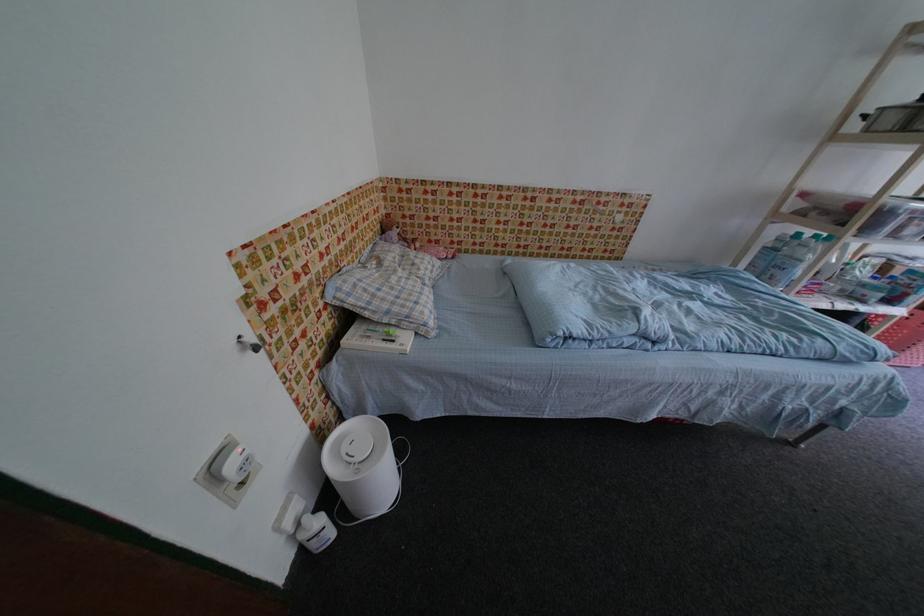
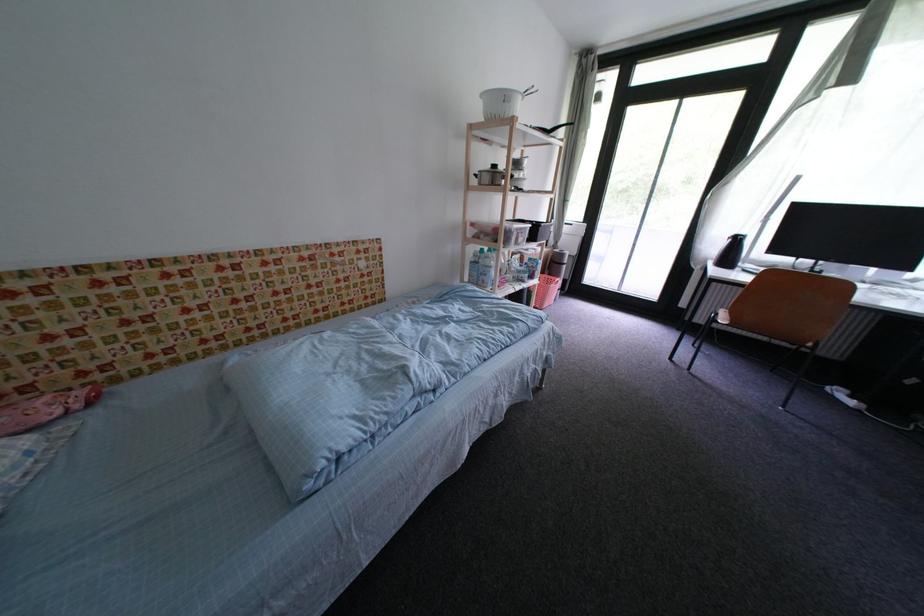
Question: How did the camera likely rotate?

Choices:
 (A) Left
 (B) Right
 (C) Up
 (D) Down

Answer: (B)